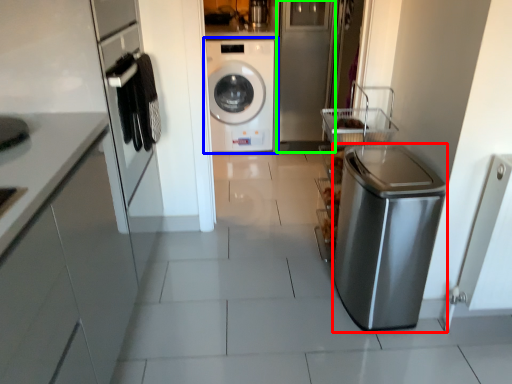
Question: Considering the real-world distances, which object is closest to dish washer (highlighted by a red box)? washing machine (highlighted by a blue box) or glass door (highlighted by a green box).

Choices:
 (A) washing machine
 (B) glass door

Answer: (B)